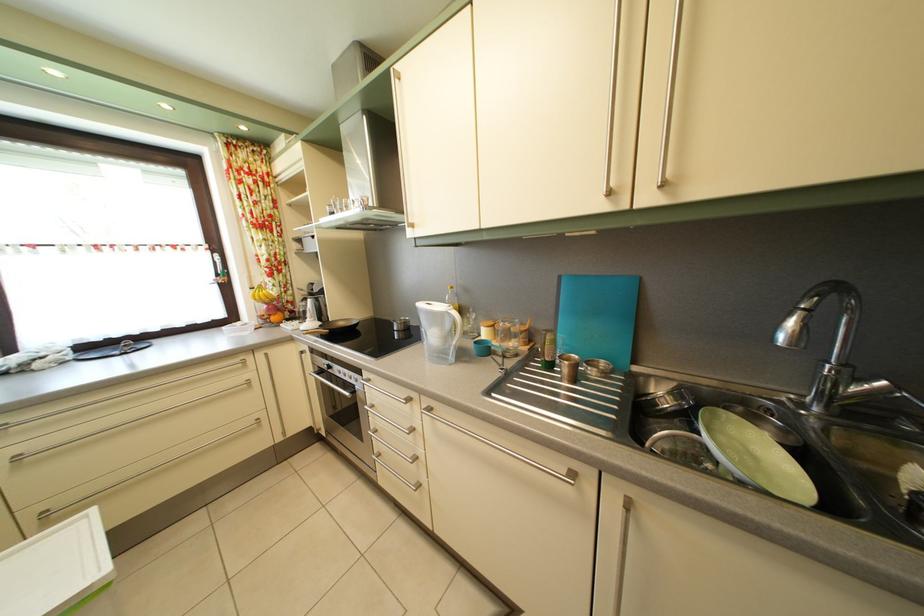
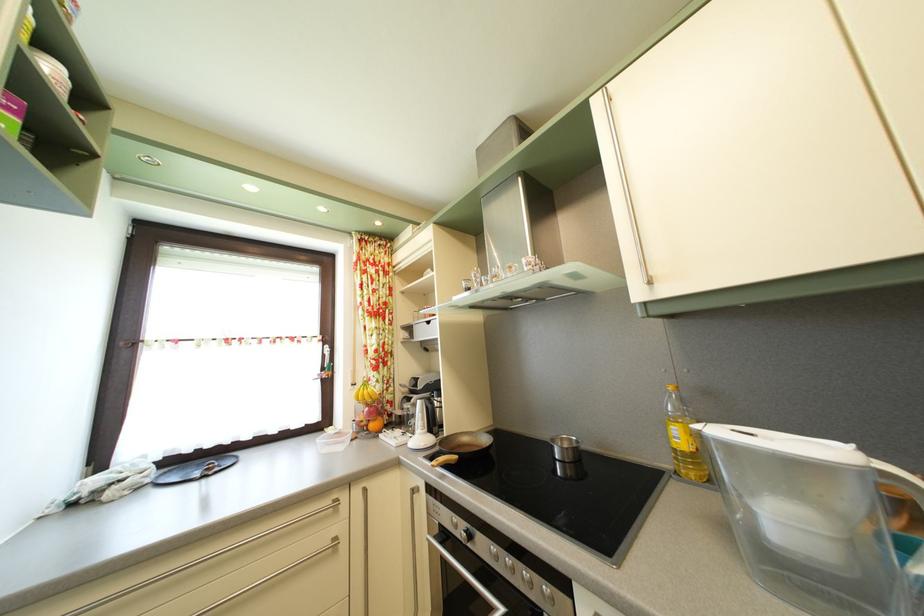
The point at (408,328) is marked in the first image. Where is the corresponding point in the second image?

(569, 448)